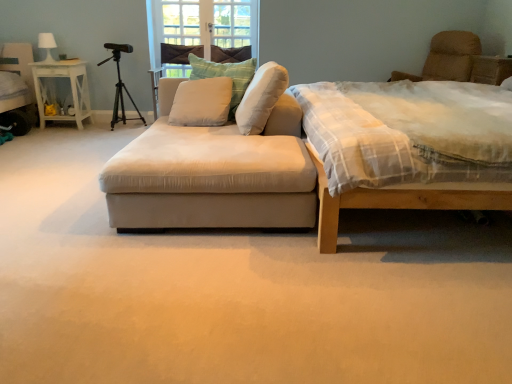
This screenshot has height=384, width=512. Describe the element at coordinates (55, 90) in the screenshot. I see `white painted wood nightstand at left` at that location.

This screenshot has width=512, height=384. What do you see at coordinates (459, 61) in the screenshot?
I see `beige fabric swivel chair at upper right` at bounding box center [459, 61].

In order to face black matte tripod at upper left, should I rotate leftwards or rightwards?

Rotate your view left by about 17.316°.

The image size is (512, 384). What are the coordinates of `white soft pillow at center, the 3th pillow from the left` in the screenshot? It's located at (261, 98).

What are the coordinates of `white soft cushion at center, marked as the second pillow in a right-to-left arrangement` in the screenshot? It's located at (226, 76).

Between white fabric lampshade at upper left and black matte tripod at upper left, which one is positioned in front?

Positioned in front is black matte tripod at upper left.

Considering the sizes of objects white fabric lampshade at upper left and black matte tripod at upper left in the image provided, who is taller, white fabric lampshade at upper left or black matte tripod at upper left?

Standing taller between the two is black matte tripod at upper left.

What's the angular difference between white fabric lampshade at upper left and black matte tripod at upper left's facing directions?

There is a 2.6-degree angle between the facing directions of white fabric lampshade at upper left and black matte tripod at upper left.

Considering the points (44, 36) and (140, 118), which point is behind, point (44, 36) or point (140, 118)?

The point (140, 118) is farther from the camera.

Considering the sizes of white soft cushion at center, which is counted as the third pillow, starting from the right, and white soft cushion at center, marked as the second pillow in a right-to-left arrangement, in the image, is white soft cushion at center, which is counted as the third pillow, starting from the right, wider or thinner than white soft cushion at center, marked as the second pillow in a right-to-left arrangement,?

Considering their sizes, white soft cushion at center, which is counted as the third pillow, starting from the right, looks broader than white soft cushion at center, marked as the second pillow in a right-to-left arrangement.

Considering the relative sizes of white soft cushion at center, which is counted as the third pillow, starting from the right, and white soft cushion at center, which is the 2th pillow from left to right, in the image provided, is white soft cushion at center, which is counted as the third pillow, starting from the right, smaller than white soft cushion at center, which is the 2th pillow from left to right,?

Correct, white soft cushion at center, which is counted as the third pillow, starting from the right, occupies less space than white soft cushion at center, which is the 2th pillow from left to right.

Considering the sizes of white soft cushion at center, which is counted as the third pillow, starting from the right, and white soft cushion at center, marked as the second pillow in a right-to-left arrangement, in the image, is white soft cushion at center, which is counted as the third pillow, starting from the right, taller or shorter than white soft cushion at center, marked as the second pillow in a right-to-left arrangement,?

In the image, white soft cushion at center, which is counted as the third pillow, starting from the right, appears to be shorter than white soft cushion at center, marked as the second pillow in a right-to-left arrangement.

Is white soft cushion at center, which is counted as the third pillow, starting from the right, positioned beyond the bounds of white soft cushion at center, which is the 2th pillow from left to right?

No, most part of white soft cushion at center, which is counted as the third pillow, starting from the right, lies within white soft cushion at center, which is the 2th pillow from left to right.

Looking at this image, from the image's perspective, is beige fabric swivel chair at upper right located above or below black matte tripod at upper left?

beige fabric swivel chair at upper right is situated higher than black matte tripod at upper left in the image.

In the image, is beige fabric swivel chair at upper right positioned in front of or behind black matte tripod at upper left?

Visually, beige fabric swivel chair at upper right is located in front of black matte tripod at upper left.

Can you confirm if beige fabric swivel chair at upper right is taller than black matte tripod at upper left?

In fact, beige fabric swivel chair at upper right may be shorter than black matte tripod at upper left.

Can you confirm if beige fabric swivel chair at upper right is wider than black matte tripod at upper left?

Indeed, beige fabric swivel chair at upper right has a greater width compared to black matte tripod at upper left.

Is beige fabric swivel chair at upper right beside white soft cushion at center, which is counted as the third pillow, starting from the right?

beige fabric swivel chair at upper right and white soft cushion at center, which is counted as the third pillow, starting from the right, are not in contact.

Between beige fabric swivel chair at upper right and white soft cushion at center, which is counted as the third pillow, starting from the right, which one appears on the left side from the viewer's perspective?

white soft cushion at center, which is counted as the third pillow, starting from the right.

Is point (446, 46) farther from camera compared to point (190, 94)?

Yes, it is behind point (190, 94).

Considering the sizes of objects beige fabric swivel chair at upper right and white soft cushion at center, which is counted as the third pillow, starting from the right, in the image provided, who is taller, beige fabric swivel chair at upper right or white soft cushion at center, which is counted as the third pillow, starting from the right,?

beige fabric swivel chair at upper right.

Measure the distance between light brown wooden bed at right and white painted wood nightstand at left.

They are 3.53 meters apart.

Is light brown wooden bed at right directly adjacent to white painted wood nightstand at left?

light brown wooden bed at right and white painted wood nightstand at left are not in contact.

Considering the positions of points (376, 86) and (40, 102), is point (376, 86) closer to camera compared to point (40, 102)?

Yes, it is.

Does light brown wooden bed at right appear on the right side of white painted wood nightstand at left?

Yes, light brown wooden bed at right is to the right of white painted wood nightstand at left.

From the image's perspective, between light brown wooden bed at right and beige fabric swivel chair at upper right, which one is located above?

beige fabric swivel chair at upper right.

Is point (340, 167) positioned behind point (449, 63)?

That is False.

Is light brown wooden bed at right next to beige fabric swivel chair at upper right?

No, light brown wooden bed at right is not next to beige fabric swivel chair at upper right.

This screenshot has height=384, width=512. I want to click on bed to the right of beige fabric studio couch at center, so pos(411,138).

Is point (127, 173) closer or farther from the camera than point (309, 89)?

Point (127, 173) is closer to the camera than point (309, 89).

From a real-world perspective, is beige fabric studio couch at center on light brown wooden bed at right?

No, from a real-world perspective, beige fabric studio couch at center is not on top of light brown wooden bed at right.

Is beige fabric studio couch at center oriented away from light brown wooden bed at right?

Absolutely, beige fabric studio couch at center is directed away from light brown wooden bed at right.

At what (x,y) coordinates should I click in order to perform the action: click on lamp positioned vertically above the black matte tripod at upper left (from a real-world perspective). Please return your answer as a coordinate pair (x, y). The image size is (512, 384). Looking at the image, I should click on (47, 45).

In the image, there is a white soft cushion at center, which is the 2th pillow from left to right. Where is `pillow below it (from a real-world perspective)`? The image size is (512, 384). pillow below it (from a real-world perspective) is located at coordinates (202, 102).

Consider the image. Which object lies further to the anchor point white soft cushion at center, which is counted as the third pillow, starting from the right, beige fabric swivel chair at upper right or black matte tripod at upper left?

Among the two, beige fabric swivel chair at upper right is located further to white soft cushion at center, which is counted as the third pillow, starting from the right.

When comparing their distances from white soft pillow at center, which is the first pillow in right-to-left order, does white soft cushion at center, marked as the second pillow in a right-to-left arrangement, or beige fabric swivel chair at upper right seem further?

beige fabric swivel chair at upper right.

Which object lies further to the anchor point white fabric lampshade at upper left, white soft pillow at center, the 3th pillow from the left, or white soft cushion at center, marked as the second pillow in a right-to-left arrangement?

white soft pillow at center, the 3th pillow from the left.

From the picture: When comparing their distances from white soft pillow at center, the 3th pillow from the left, does white fabric lampshade at upper left or black matte tripod at upper left seem closer?

The object closer to white soft pillow at center, the 3th pillow from the left, is black matte tripod at upper left.

Based on the photo, based on their spatial positions, is white fabric lampshade at upper left or white painted wood nightstand at left closer to beige fabric studio couch at center?

white painted wood nightstand at left lies closer to beige fabric studio couch at center than the other object.

Estimate the real-world distances between objects in this image. Which object is further from white fabric lampshade at upper left, beige fabric studio couch at center or white painted wood nightstand at left?

beige fabric studio couch at center is positioned further to the anchor white fabric lampshade at upper left.

Looking at the image, which one is located further to white soft cushion at center, which is the 2th pillow from left to right, beige fabric swivel chair at upper right or black matte tripod at upper left?

The object further to white soft cushion at center, which is the 2th pillow from left to right, is beige fabric swivel chair at upper right.

Considering their positions, is white painted wood nightstand at left positioned further to beige fabric swivel chair at upper right than light brown wooden bed at right?

white painted wood nightstand at left is positioned further to the anchor beige fabric swivel chair at upper right.

Identify the location of pillow between beige fabric studio couch at center and white soft cushion at center, which is counted as the third pillow, starting from the right, along the z-axis. The width and height of the screenshot is (512, 384). (261, 98).

Identify the location of bed between white painted wood nightstand at left and beige fabric swivel chair at upper right. (411, 138).

What are the coordinates of `bed located between white soft cushion at center, which is counted as the third pillow, starting from the right, and beige fabric swivel chair at upper right in the left-right direction` in the screenshot? It's located at (411, 138).

Identify the location of pillow located between white soft pillow at center, the 3th pillow from the left, and white soft cushion at center, marked as the second pillow in a right-to-left arrangement, in the depth direction. (202, 102).